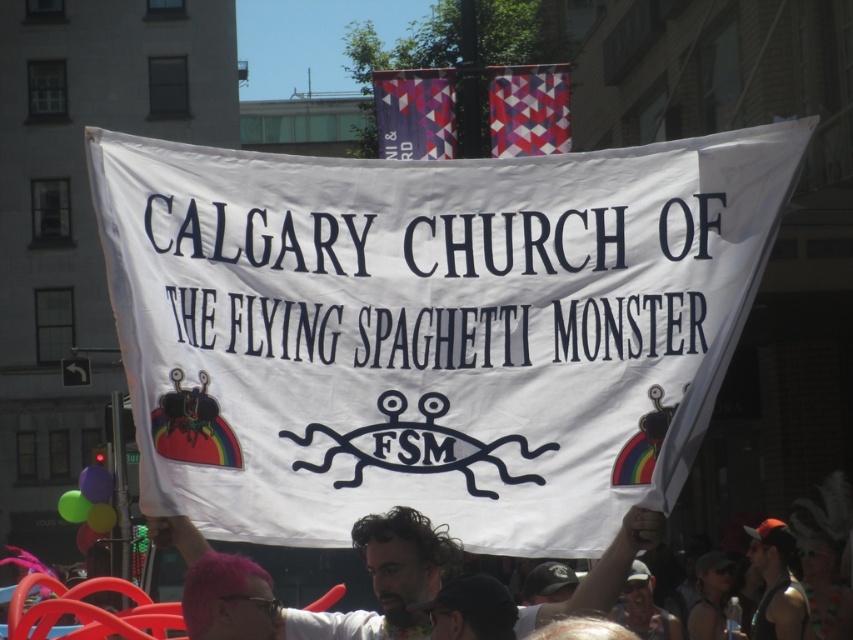
You are a photographer at the Calgary Church of the Flying Spaghetti Monster parade. You notice two people in your viewfinder. One has curly hair at center and another has a black fabric cap at lower right. Which person is closer to you?

The curly hair at center is closer to you because it is in front of the black fabric cap at lower right.

You are a photographer at the Calgary Church of the Flying Spaghetti Monster parade. You notice two items in your viewfinder. One is curly hair at center and the other is black fabric cap at lower right. Which item appears larger in your camera frame?

The curly hair at center appears larger in the camera frame because it is bigger than the black fabric cap at lower right.

You are a photographer standing at the center of the scene. You want to take a photo that includes both the point at coordinates point [91,488] and point [83,468]. Which point should you focus on first to ensure both are in sharp focus?

Point [91,488] is closer to the viewer than point [83,468], so you should focus on point [91,488] first to ensure both are in sharp focus.